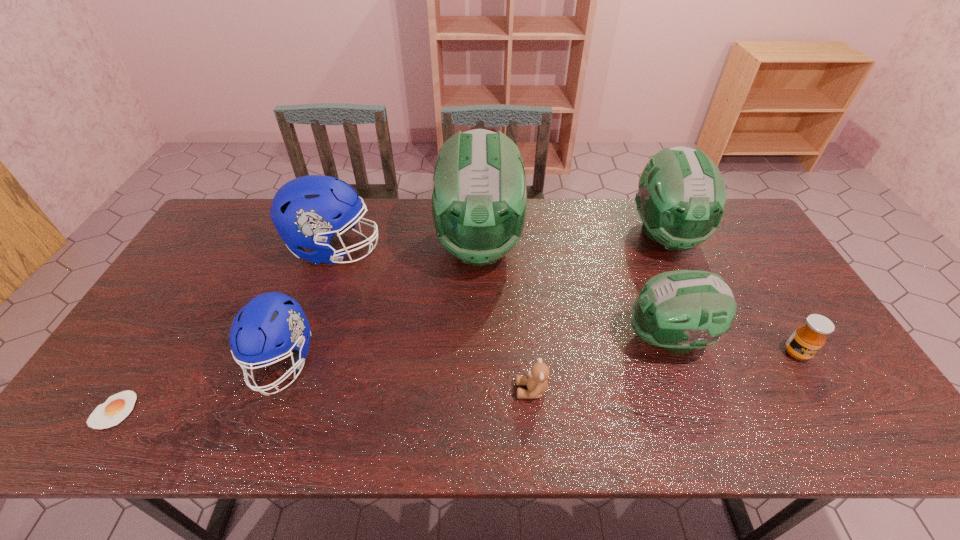
The image size is (960, 540). Identify the location of the biggest green football helmet. (479, 195).

You are a GUI agent. You are given a task and a screenshot of the screen. Output one action in this format:
    pyautogui.click(x=<x>, y=<y>)
    Task: Click on the tallest football helmet
    This screenshot has height=540, width=960.
    Given the screenshot: What is the action you would take?
    pyautogui.click(x=479, y=195)

I want to click on the second biggest green football helmet, so pos(681,197).

You are a GUI agent. You are given a task and a screenshot of the screen. Output one action in this format:
    pyautogui.click(x=<x>, y=<y>)
    Task: Click on the bigger blue football helmet
    This screenshot has height=540, width=960.
    Given the screenshot: What is the action you would take?
    pyautogui.click(x=308, y=211)

Identify the location of the smallest green football helmet. Image resolution: width=960 pixels, height=540 pixels. (680, 310).

Image resolution: width=960 pixels, height=540 pixels. I want to click on the nearer blue football helmet, so click(272, 318).

Where is `orange honey`? orange honey is located at coordinates (808, 338).

The width and height of the screenshot is (960, 540). In order to click on the third shortest object in this screenshot , I will do `click(808, 338)`.

What are the coordinates of `the second shortest object` in the screenshot? It's located at (536, 380).

At what (x,y) coordinates should I click in order to perform the action: click on teddy bear. Please return your answer as a coordinate pair (x, y). Looking at the image, I should click on (536, 380).